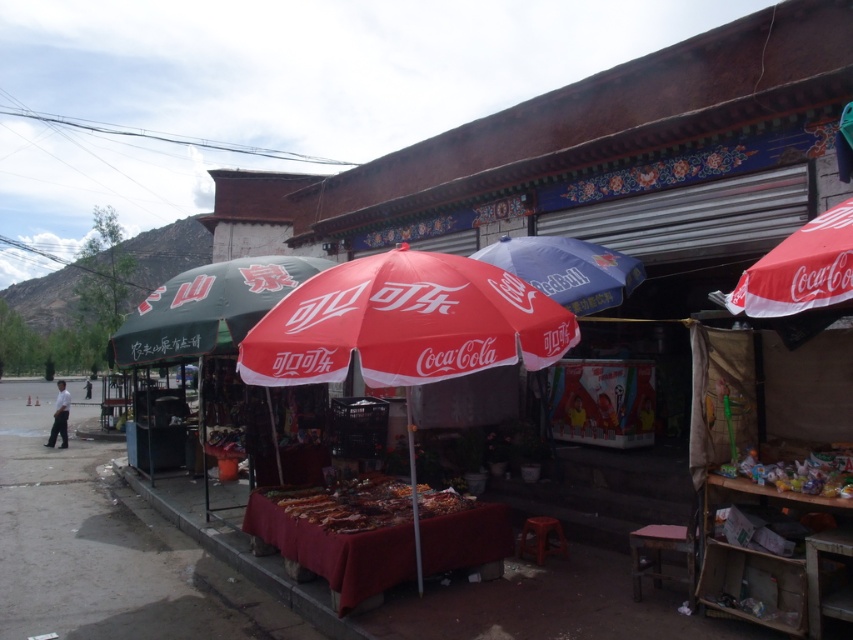
Is point (64, 452) closer to viewer compared to point (833, 228)?

No, (64, 452) is further to viewer.

What do you see at coordinates (105, 548) in the screenshot?
I see `gray concrete pavement at lower left` at bounding box center [105, 548].

This screenshot has width=853, height=640. Find the location of `gray concrete pavement at lower left`. gray concrete pavement at lower left is located at coordinates pos(105,548).

Between gray concrete pavement at lower left and green fabric umbrella at left, which one appears on the left side from the viewer's perspective?

From the viewer's perspective, gray concrete pavement at lower left appears more on the left side.

Who is positioned more to the right, gray concrete pavement at lower left or green fabric umbrella at left?

Positioned to the right is green fabric umbrella at left.

What do you see at coordinates (105, 548) in the screenshot?
I see `gray concrete pavement at lower left` at bounding box center [105, 548].

This screenshot has height=640, width=853. I want to click on gray concrete pavement at lower left, so click(x=105, y=548).

Is gray concrete pavement at lower left further to the viewer compared to white matte shirt at left?

No, gray concrete pavement at lower left is closer to the viewer.

Is point (97, 628) in front of point (57, 417)?

Yes, it is in front of point (57, 417).

What do you see at coordinates (105, 548) in the screenshot? I see `gray concrete pavement at lower left` at bounding box center [105, 548].

At what (x,y) coordinates should I click in order to perform the action: click on gray concrete pavement at lower left. Please return your answer as a coordinate pair (x, y). The height and width of the screenshot is (640, 853). Looking at the image, I should click on (105, 548).